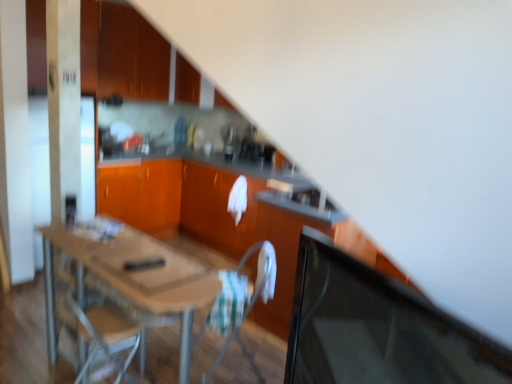
Question: Does wooden table at center touch black glossy computer monitor at right?

Choices:
 (A) no
 (B) yes

Answer: (A)

Question: Is wooden table at center shorter than black glossy computer monitor at right?

Choices:
 (A) yes
 (B) no

Answer: (B)

Question: Does wooden table at center have a larger size compared to black glossy computer monitor at right?

Choices:
 (A) yes
 (B) no

Answer: (A)

Question: Is wooden table at center not near black glossy computer monitor at right?

Choices:
 (A) no
 (B) yes

Answer: (B)

Question: Considering the relative positions of wooden table at center and black glossy computer monitor at right in the image provided, is wooden table at center in front of black glossy computer monitor at right?

Choices:
 (A) yes
 (B) no

Answer: (B)

Question: From a real-world perspective, is black glossy computer monitor at right above or below matte wood cabinets at upper left, positioned as the 2th cabinetry in bottom-to-top order?

Choices:
 (A) above
 (B) below

Answer: (B)

Question: From the image's perspective, relative to matte wood cabinets at upper left, acting as the 1th cabinetry starting from the top, is black glossy computer monitor at right above or below?

Choices:
 (A) above
 (B) below

Answer: (B)

Question: Do you think black glossy computer monitor at right is within matte wood cabinets at upper left, acting as the 1th cabinetry starting from the top, or outside of it?

Choices:
 (A) inside
 (B) outside

Answer: (B)

Question: Is black glossy computer monitor at right taller or shorter than matte wood cabinets at upper left, acting as the 1th cabinetry starting from the top?

Choices:
 (A) tall
 (B) short

Answer: (B)

Question: Based on their sizes in the image, would you say matte wood cabinets at upper left, acting as the 1th cabinetry starting from the top, is bigger or smaller than wooden table at center?

Choices:
 (A) small
 (B) big

Answer: (A)

Question: From the image's perspective, is matte wood cabinets at upper left, acting as the 1th cabinetry starting from the top, located above or below wooden table at center?

Choices:
 (A) above
 (B) below

Answer: (A)

Question: Considering the positions of point (165, 59) and point (130, 160), is point (165, 59) closer or farther from the camera than point (130, 160)?

Choices:
 (A) farther
 (B) closer

Answer: (A)

Question: Relative to wooden table at center, is matte wood cabinets at upper left, acting as the 1th cabinetry starting from the top, in front or behind?

Choices:
 (A) behind
 (B) front

Answer: (A)

Question: From a real-world perspective, relative to wooden table at center, is matte wood cabinets at upper left, positioned as the 2th cabinetry in bottom-to-top order, vertically above or below?

Choices:
 (A) above
 (B) below

Answer: (A)

Question: Considering the positions of point (135, 67) and point (141, 251), is point (135, 67) closer or farther from the camera than point (141, 251)?

Choices:
 (A) closer
 (B) farther

Answer: (B)